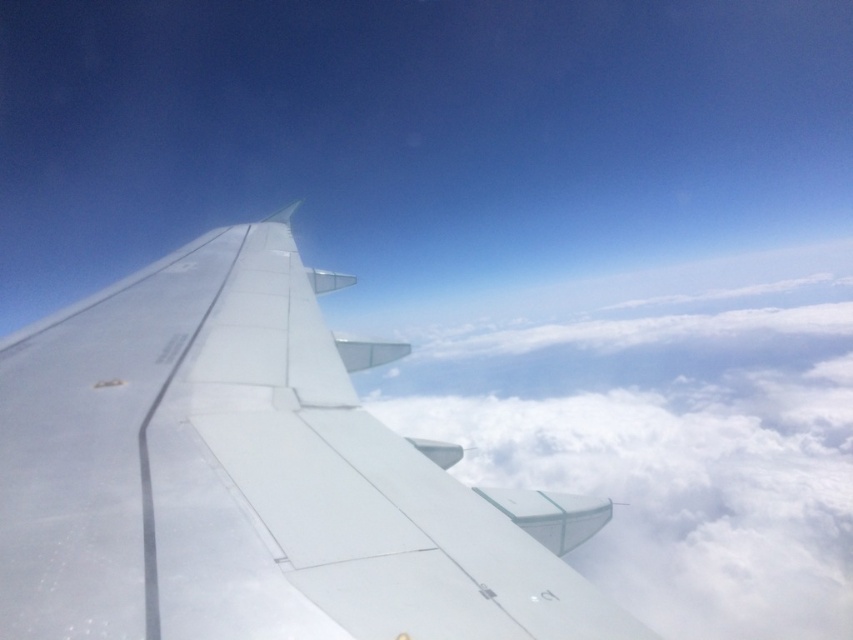
Question: Does white matte airplane wing at upper left have a smaller size compared to white fluffy cloud at center?

Choices:
 (A) no
 (B) yes

Answer: (B)

Question: Is white matte airplane wing at upper left to the right of white fluffy cloud at center from the viewer's perspective?

Choices:
 (A) no
 (B) yes

Answer: (A)

Question: Which point is closer to the camera taking this photo?

Choices:
 (A) (704, 310)
 (B) (264, 316)

Answer: (B)

Question: Among these points, which one is nearest to the camera?

Choices:
 (A) (434, 356)
 (B) (254, 412)

Answer: (B)

Question: Does white matte airplane wing at upper left have a larger size compared to white fluffy cloud at center?

Choices:
 (A) yes
 (B) no

Answer: (B)